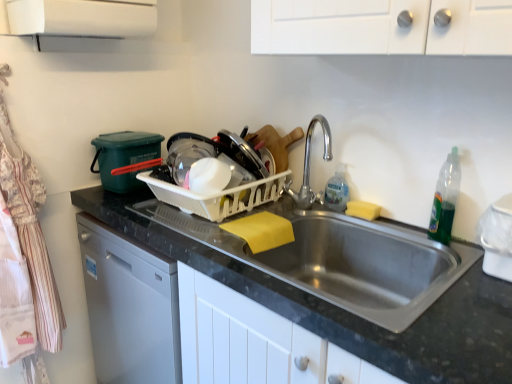
This screenshot has height=384, width=512. I want to click on vacant space in front of clear plastic bottle at sink, so click(362, 220).